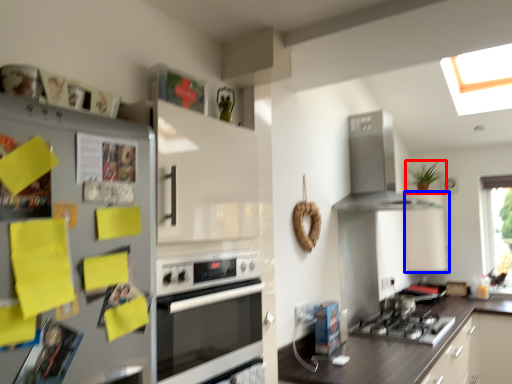
Question: Among these objects, which one is farthest to the camera, houseplant (highlighted by a red box) or cabinetry (highlighted by a blue box)?

Choices:
 (A) houseplant
 (B) cabinetry

Answer: (A)